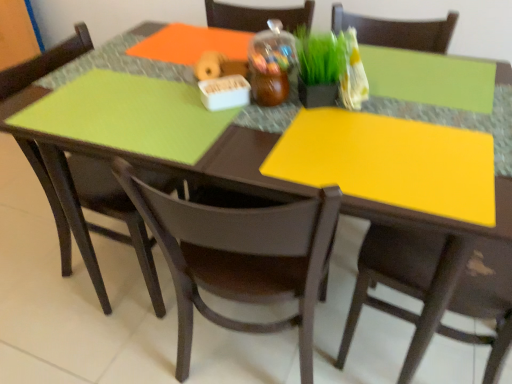
Question: Is green matte grass at center completely or partially inside matte black chair at right, acting as the 3th chair starting from the left?

Choices:
 (A) yes
 (B) no

Answer: (B)

Question: Is matte black chair at right, acting as the 3th chair starting from the left, at the left side of green matte grass at center?

Choices:
 (A) yes
 (B) no

Answer: (B)

Question: Considering the relative sizes of matte black chair at right, marked as the first chair in a right-to-left arrangement, and green matte grass at center in the image provided, is matte black chair at right, marked as the first chair in a right-to-left arrangement, shorter than green matte grass at center?

Choices:
 (A) no
 (B) yes

Answer: (A)

Question: Is matte black chair at right, marked as the first chair in a right-to-left arrangement, facing away from green matte grass at center?

Choices:
 (A) no
 (B) yes

Answer: (A)

Question: Relative to matte black chair at right, acting as the 3th chair starting from the left, is matte brown chair at center, placed as the 2th chair when sorted from left to right, in front or behind?

Choices:
 (A) behind
 (B) front

Answer: (A)

Question: From the image's perspective, is matte brown chair at center, placed as the 2th chair when sorted from left to right, positioned above or below matte black chair at right, marked as the first chair in a right-to-left arrangement?

Choices:
 (A) below
 (B) above

Answer: (B)

Question: From a real-world perspective, is matte brown chair at center, the second chair viewed from the right, positioned above or below matte black chair at right, acting as the 3th chair starting from the left?

Choices:
 (A) above
 (B) below

Answer: (A)

Question: In terms of height, does matte brown chair at center, placed as the 2th chair when sorted from left to right, look taller or shorter compared to matte black chair at right, marked as the first chair in a right-to-left arrangement?

Choices:
 (A) short
 (B) tall

Answer: (A)

Question: Considering the positions of matte brown chair at center, the second chair viewed from the right, and matte black chair at lower left, marked as the first chair in a left-to-right arrangement, in the image, is matte brown chair at center, the second chair viewed from the right, wider or thinner than matte black chair at lower left, marked as the first chair in a left-to-right arrangement,?

Choices:
 (A) wide
 (B) thin

Answer: (B)

Question: From the image's perspective, relative to matte black chair at lower left, which is counted as the 3th chair, starting from the right, is matte brown chair at center, placed as the 2th chair when sorted from left to right, above or below?

Choices:
 (A) below
 (B) above

Answer: (A)

Question: From a real-world perspective, is matte brown chair at center, the second chair viewed from the right, physically located above or below matte black chair at lower left, which is counted as the 3th chair, starting from the right?

Choices:
 (A) below
 (B) above

Answer: (B)

Question: Visually, is matte brown chair at center, the second chair viewed from the right, positioned to the left or to the right of matte black chair at lower left, which is counted as the 3th chair, starting from the right?

Choices:
 (A) left
 (B) right

Answer: (B)

Question: In terms of size, does green matte grass at center appear bigger or smaller than matte black chair at right, marked as the first chair in a right-to-left arrangement?

Choices:
 (A) small
 (B) big

Answer: (A)

Question: Is green matte grass at center spatially inside matte black chair at right, marked as the first chair in a right-to-left arrangement, or outside of it?

Choices:
 (A) inside
 (B) outside

Answer: (B)